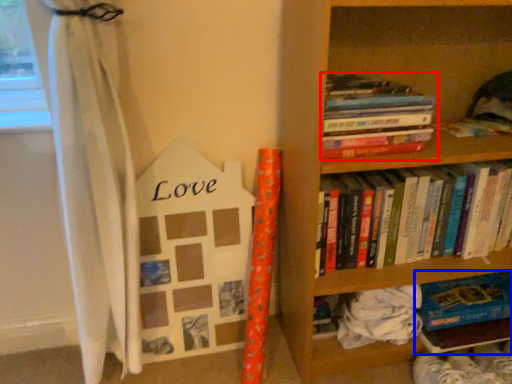
Question: Which of the following is the closest to the observer, book (highlighted by a red box) or book (highlighted by a blue box)?

Choices:
 (A) book
 (B) book

Answer: (A)